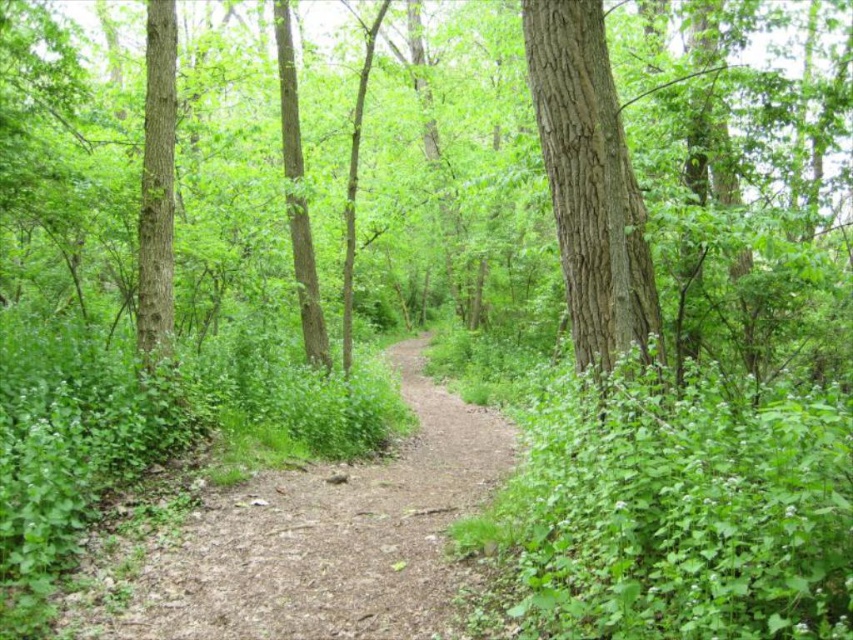
You are a hiker who needs to walk along the path. The brown dirt path at center and the smooth brown tree trunk at left are both in your way. Which one should you follow to stay on the correct trail?

You should follow the brown dirt path at center because it is larger in size than the smooth brown tree trunk at left, making it the correct trail to follow.

You are a hiker standing on the brown dirt path at center and looking towards the brown rough tree at center. Which object is closer to you?

The brown rough tree at center is closer to you than the brown dirt path at center.

You are standing at the start of the dirt path in the forest scene. You notice a point marked at coordinates (589,182). What object is located at that point?

The point at coordinates (589,182) indicates a brown textured bark tree at center.